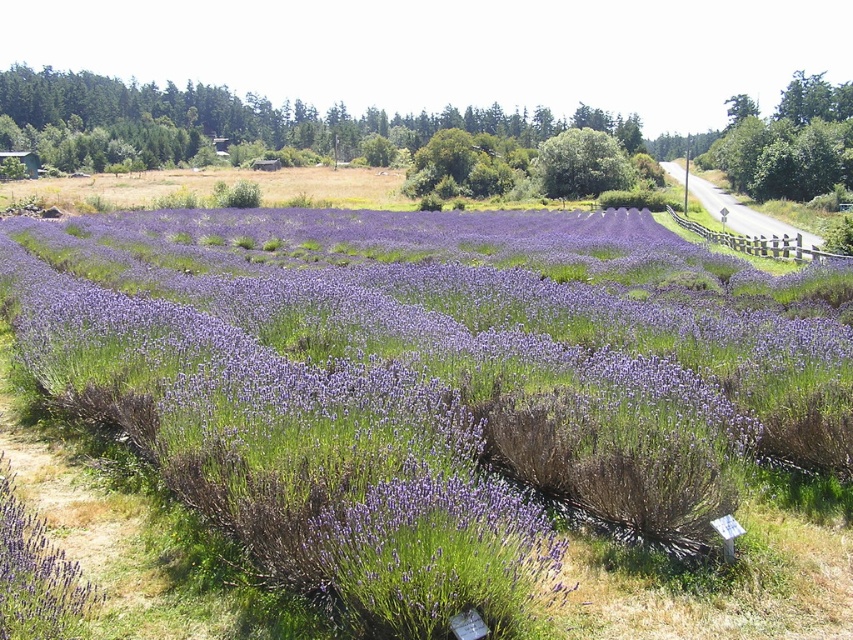
You are standing in the lavender field and want to walk from the point at coordinates point [366,220] to the point at coordinates point [12,621]. Which direction should you face to move towards the second point?

To move from point [366,220] to point [12,621], you should face southeast because point [12,621] is located to the southeast of point [366,220].